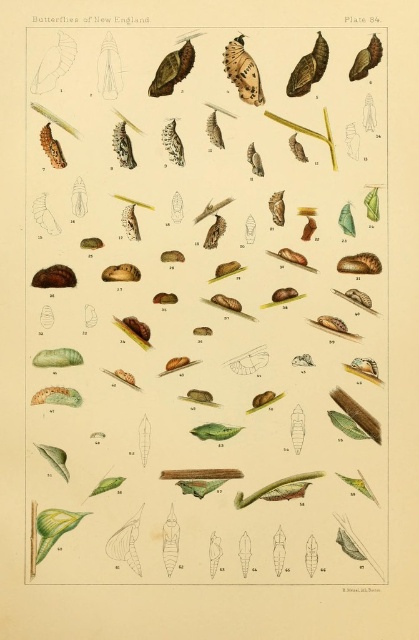
In the scene shown: You are examining the scientific illustration of butterfly metamorphosis. There are two points labeled in the image. The first point is at coordinates point (328,84), and the second is at point (230,44). Which of these points is closer to you?

Point (328,84) is further to the viewer than point (230,44), so the point at (230,44) is closer to you.